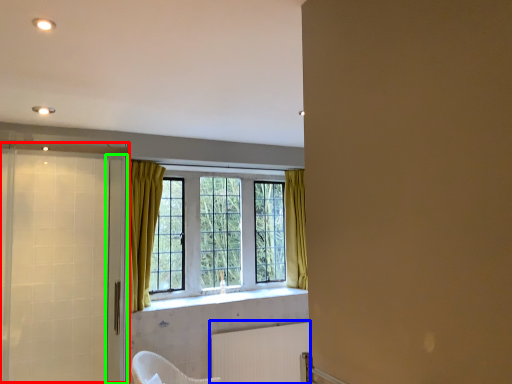
Question: Which object is the farthest from screen door (highlighted by a red box)? Choose among these: radiator (highlighted by a blue box) or screen door (highlighted by a green box).

Choices:
 (A) radiator
 (B) screen door

Answer: (A)